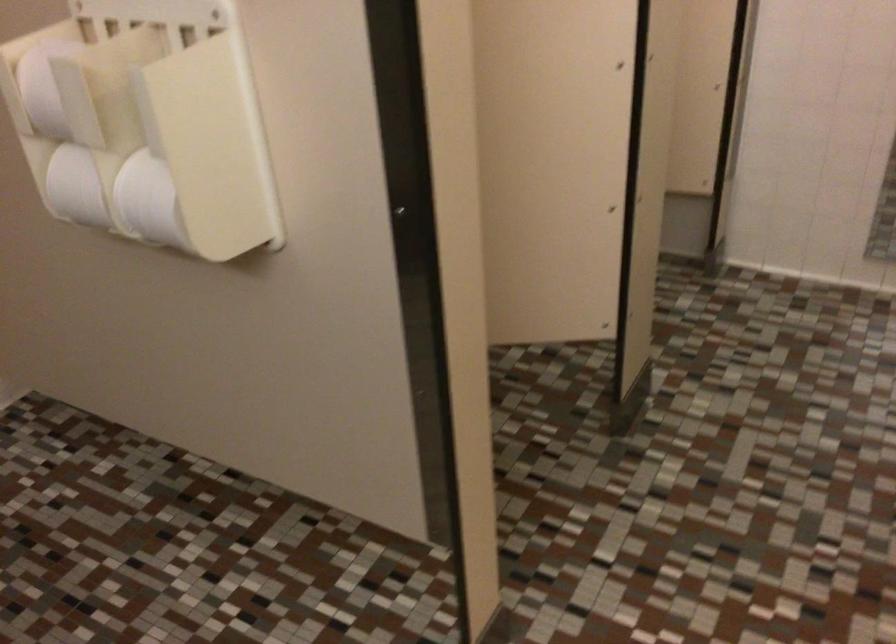
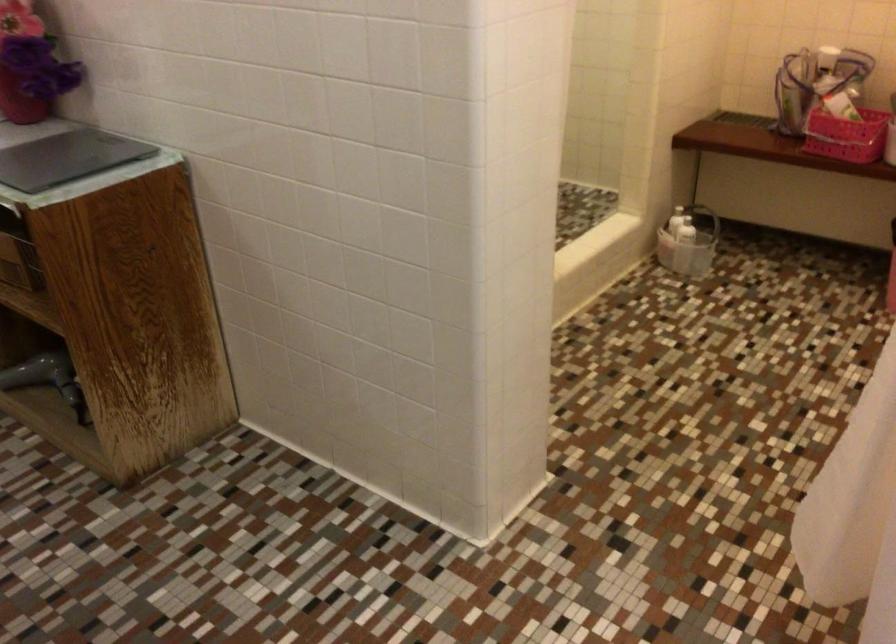
How did the camera likely rotate?

The camera rotated toward right-down.